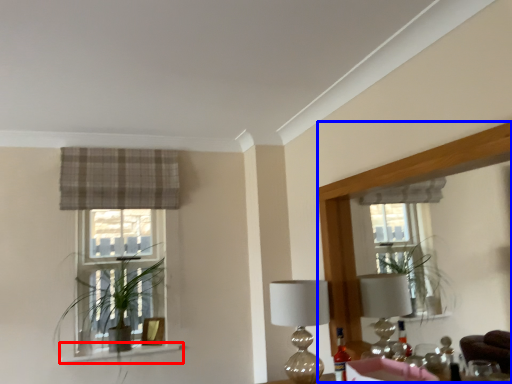
Question: Among these objects, which one is farthest to the camera, window sill (highlighted by a red box) or mirror (highlighted by a blue box)?

Choices:
 (A) window sill
 (B) mirror

Answer: (A)